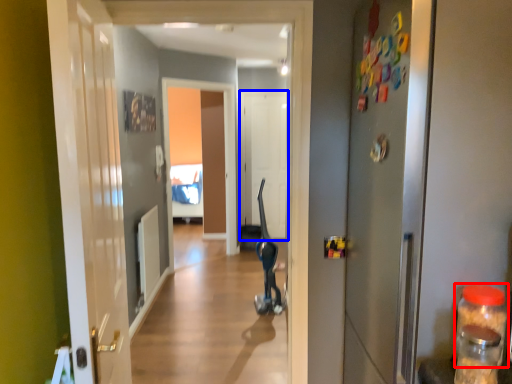
Question: Which of the following is the farthest to the observer, bottle (highlighted by a red box) or door (highlighted by a blue box)?

Choices:
 (A) bottle
 (B) door

Answer: (B)